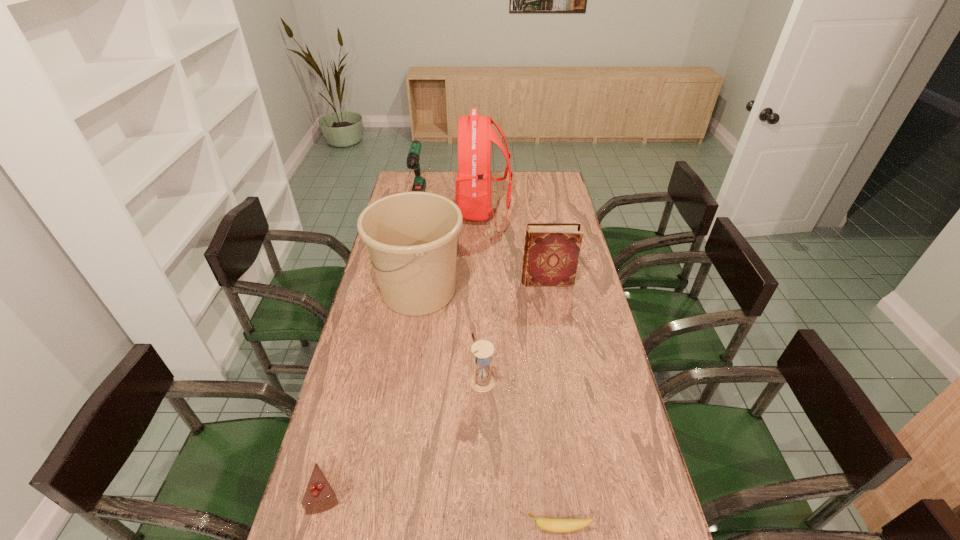
You are a GUI agent. You are given a task and a screenshot of the screen. Output one action in this format:
    pyautogui.click(x=<x>, y=<y>)
    Task: Click on the backpack
    This screenshot has width=960, height=540.
    Given the screenshot: What is the action you would take?
    pyautogui.click(x=475, y=134)

Locate an element on the screen. bucket is located at coordinates pyautogui.click(x=411, y=237).

Where is `drill`? The height and width of the screenshot is (540, 960). drill is located at coordinates (419, 185).

The image size is (960, 540). What are the coordinates of `hardback book` in the screenshot? It's located at (551, 252).

Locate an element on the screen. the fifth farthest object is located at coordinates (482, 381).

The width and height of the screenshot is (960, 540). What are the coordinates of `hourglass` in the screenshot? It's located at point(482,381).

The width and height of the screenshot is (960, 540). In order to click on chocolate cake in this screenshot , I will do `click(319, 496)`.

The image size is (960, 540). Find the location of `banana`. banana is located at coordinates (553, 525).

In order to click on free space located on the main compartment of the backpack in this screenshot , I will do `click(396, 212)`.

Identify the location of free spot located on the main compartment of the backpack. The image size is (960, 540). (422, 212).